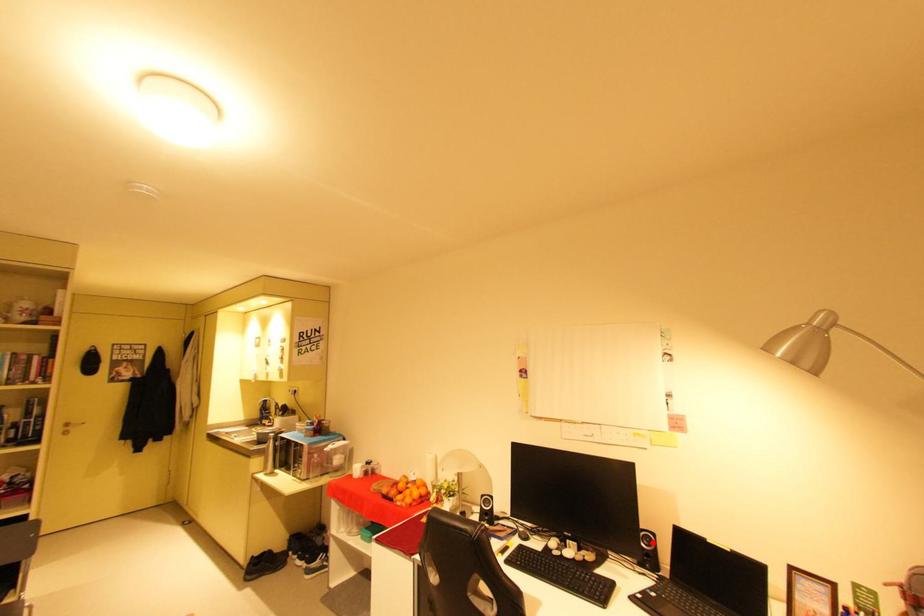
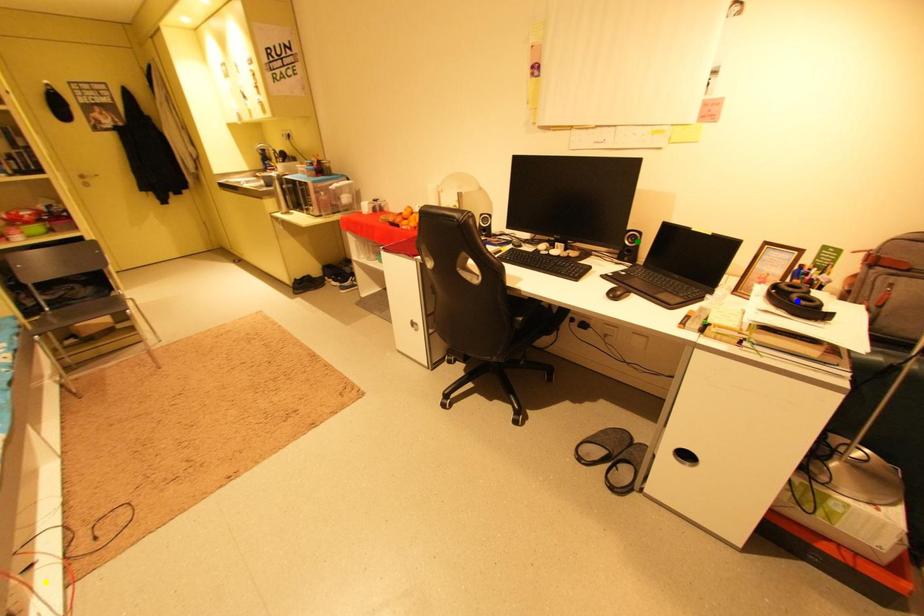
Question: I am providing you with two images of the same scene from different viewpoints. A red point is marked on the first image. You are given multiple points on the second image. Which mark in image 2 goes with the point in image 1?

Choices:
 (A) green point
 (B) blue point
 (C) yellow point

Answer: (A)